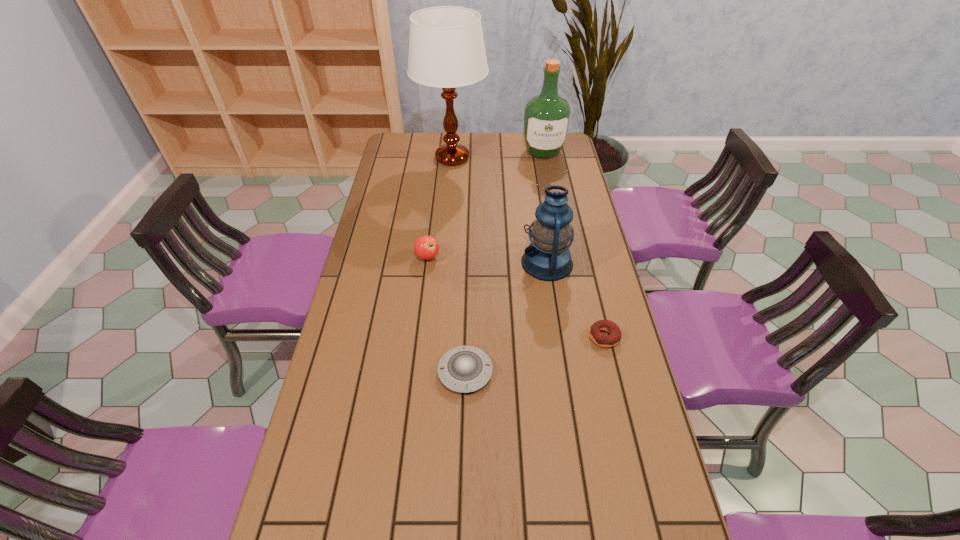
At what (x,y) coordinates should I click in order to perform the action: click on the tallest object. Please return your answer as a coordinate pair (x, y). Image resolution: width=960 pixels, height=540 pixels. Looking at the image, I should click on (446, 46).

I want to click on the fifth shortest object, so click(546, 116).

Identify the location of the fourth shortest object. (547, 258).

The image size is (960, 540). I want to click on the third shortest object, so click(426, 247).

Find the location of a particular element. saucer is located at coordinates (463, 369).

I want to click on doughnut, so click(614, 338).

You are a GUI agent. You are given a task and a screenshot of the screen. Output one action in this format:
    pyautogui.click(x=<x>, y=<y>)
    Task: Click on the vacant position located on the front of the tallest object
    This screenshot has height=540, width=960.
    Given the screenshot: What is the action you would take?
    pyautogui.click(x=447, y=218)

Find the location of `vacant region located on the front-facing side of the second tallest object`. vacant region located on the front-facing side of the second tallest object is located at coordinates (551, 194).

The image size is (960, 540). Identify the location of vacant space located on the face of the fourth shortest object. click(x=477, y=263).

Where is `vacant region located 0.400m on the face of the fourth shortest object`? The height and width of the screenshot is (540, 960). vacant region located 0.400m on the face of the fourth shortest object is located at coordinates (404, 263).